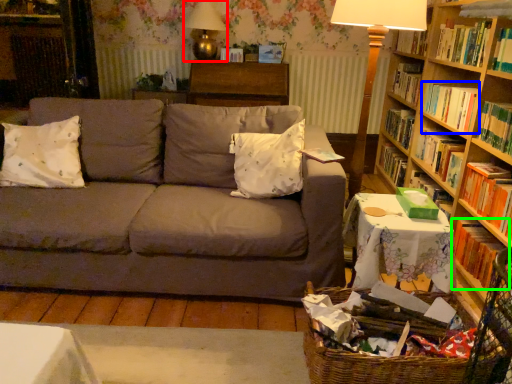
Question: Which object is positioned farthest from table lamp (highlighted by a red box)? Select from book (highlighted by a blue box) and book (highlighted by a green box).

Choices:
 (A) book
 (B) book

Answer: (B)